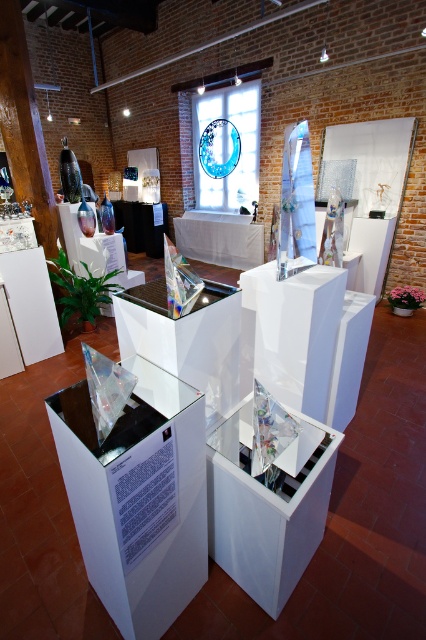
You are an art curator planning to install a new light fixture in the art exhibition space. The light fixture requires a minimum height clearance of 2 meters. Based on the scene, can the transparent glass sculpture at center and the transparent glass table at center accommodate this requirement?

The transparent glass sculpture at center is much taller than the transparent glass table at center. Since the sculpture is taller, it likely exceeds the 2 meters height requirement, so the light fixture may not be suitable for installation here.

You are an art curator planning to move the transparent glass sculpture at center to the transparent glass table at center. Based on the scene description, will the sculpture fit on the table without overhanging?

The transparent glass sculpture at center is bigger than the transparent glass table at center, so it will overhang and not fit properly.